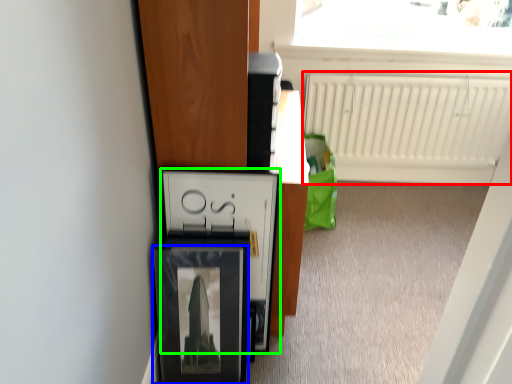
Question: Which object is positioned closest to radiator (highlighted by a red box)? Select from picture frame (highlighted by a blue box) and cabinetry (highlighted by a green box).

Choices:
 (A) picture frame
 (B) cabinetry

Answer: (B)